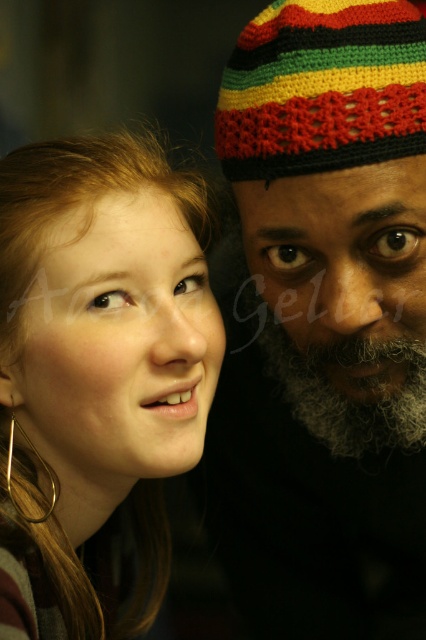
Is knitted multicolored beanie at right thinner than gray curly beard at center?

Incorrect, knitted multicolored beanie at right's width is not less than gray curly beard at center's.

Is point (400, 44) positioned before point (420, 385)?

That is True.

The width and height of the screenshot is (426, 640). In order to click on knitted multicolored beanie at right in this screenshot , I will do `click(324, 323)`.

Can you confirm if knitted multicolor beanie at upper right is bigger than gray curly beard at center?

No.

This screenshot has width=426, height=640. I want to click on knitted multicolor beanie at upper right, so click(322, 88).

Image resolution: width=426 pixels, height=640 pixels. What do you see at coordinates (97, 378) in the screenshot?
I see `matte gold hoop earring at left` at bounding box center [97, 378].

Between point (2, 349) and point (321, 381), which one is positioned in front?

Point (2, 349) is in front.

I want to click on matte gold hoop earring at left, so click(x=97, y=378).